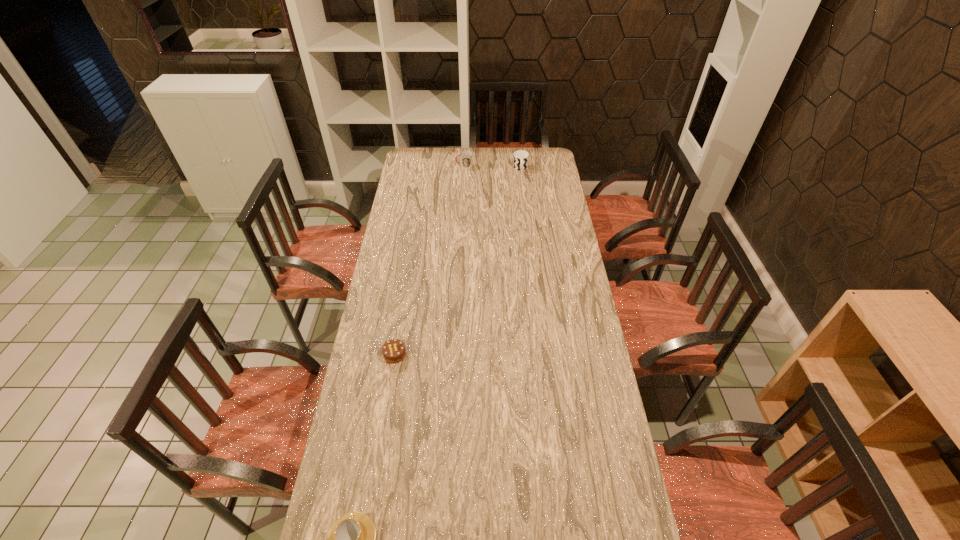
Where is `the rightmost object`? The width and height of the screenshot is (960, 540). the rightmost object is located at coordinates pyautogui.click(x=520, y=160).

The image size is (960, 540). I want to click on the second cup from right to left, so click(x=465, y=156).

Where is `chocolate cake`? This screenshot has height=540, width=960. chocolate cake is located at coordinates (393, 350).

The height and width of the screenshot is (540, 960). Find the location of `vacant space located 0.350m on the side of the rightmost object with the handle`. vacant space located 0.350m on the side of the rightmost object with the handle is located at coordinates (525, 213).

At what (x,y) coordinates should I click in order to perform the action: click on vacant point located on the side of the third object from left to right where the handle is located. Please return your answer as a coordinate pair (x, y). Image resolution: width=960 pixels, height=540 pixels. Looking at the image, I should click on (429, 166).

What are the coordinates of `vacant region located on the side of the third object from left to right where the handle is located` in the screenshot? It's located at (440, 166).

I want to click on free point located on the side of the third object from left to right where the handle is located, so click(x=445, y=166).

Locate an element on the screen. The width and height of the screenshot is (960, 540). free space located 0.220m on the back of the second nearest object is located at coordinates (403, 301).

Identify the location of object located in the left edge section of the desktop. The image size is (960, 540). (393, 350).

Image resolution: width=960 pixels, height=540 pixels. Identify the location of vacant space at the far edge of the desktop. (449, 167).